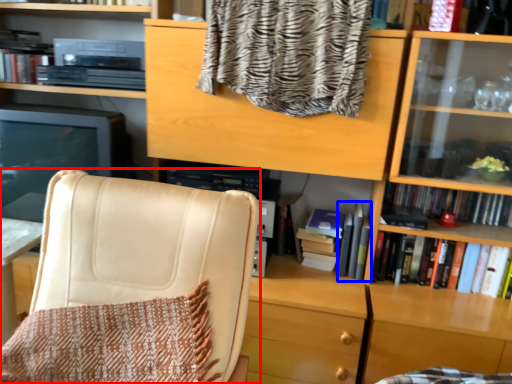
Question: Which of the following is the farthest to the observer, chair (highlighted by a red box) or book (highlighted by a blue box)?

Choices:
 (A) chair
 (B) book

Answer: (B)